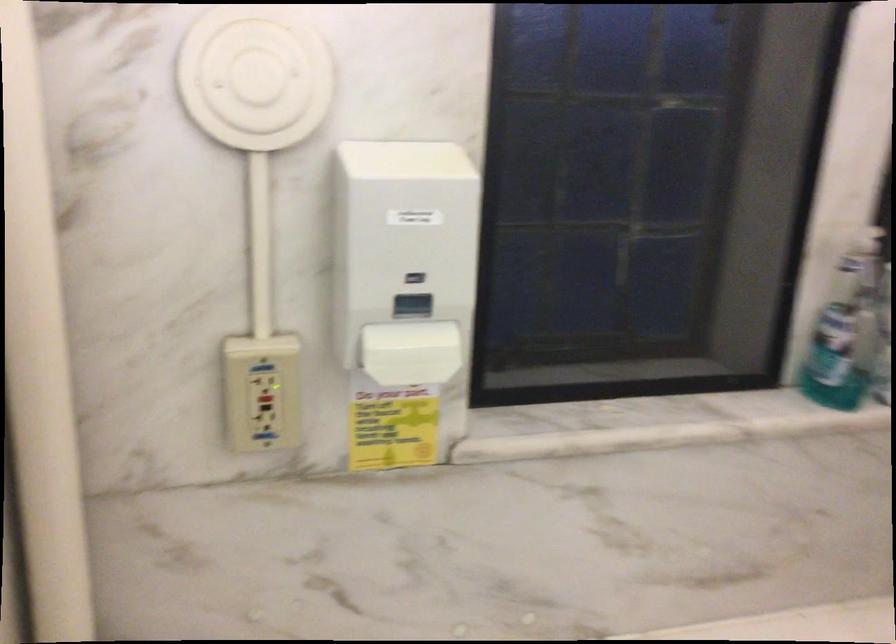
Find where to push the white dispenser actuator. Please return your answer as a coordinate pair (x, y).

(403, 295)